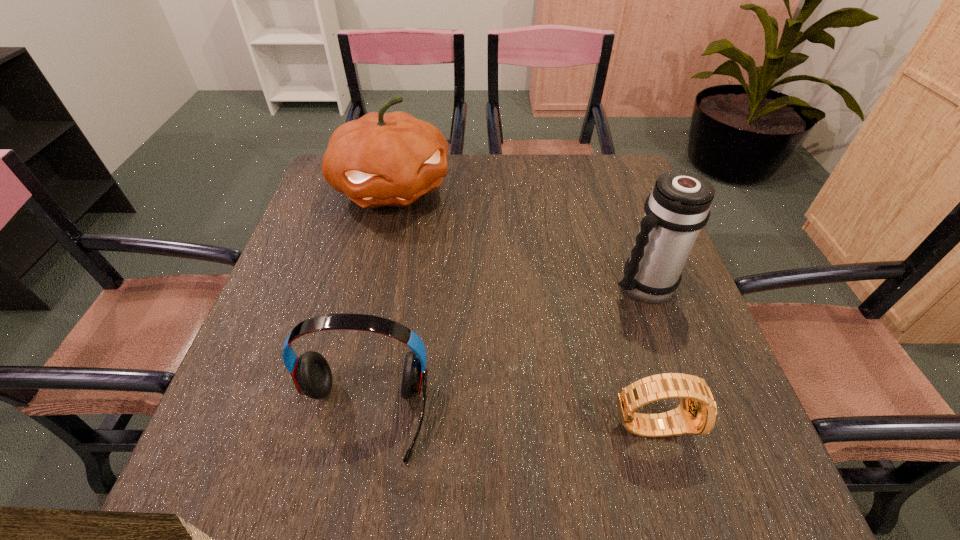
Find the location of a particular element. Image resolution: width=960 pixels, height=540 pixels. free point that satisfies the following two spatial constraints: 1. with the microphone attached to the side of the watch; 2. on the face of the second shortest object is located at coordinates [x=361, y=424].